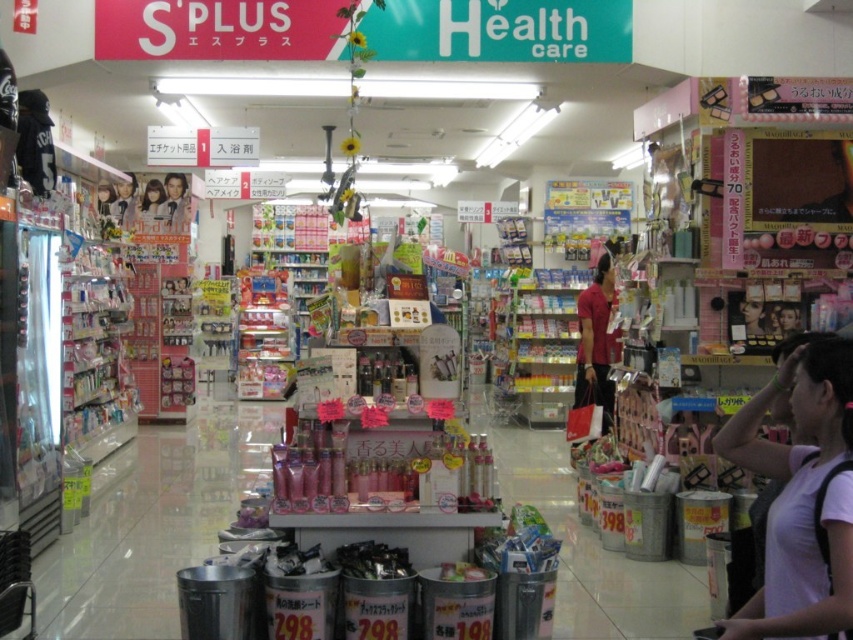
You are a customer in the store and want to locate the smooth skin portrait at upper left and the matte black hair at left. Which one is positioned more to the left side of the store?

The matte black hair at left is positioned more to the left side of the store because the smooth skin portrait at upper left is to the right of it.

You are a customer in the store and want to grab both the white matte shirt at lower right and the smooth skin doll at upper left. Which item is closer to your right hand if you are facing the shelves?

The white matte shirt at lower right is positioned on the right side of smooth skin doll at upper left, so it will be closer to your right hand.